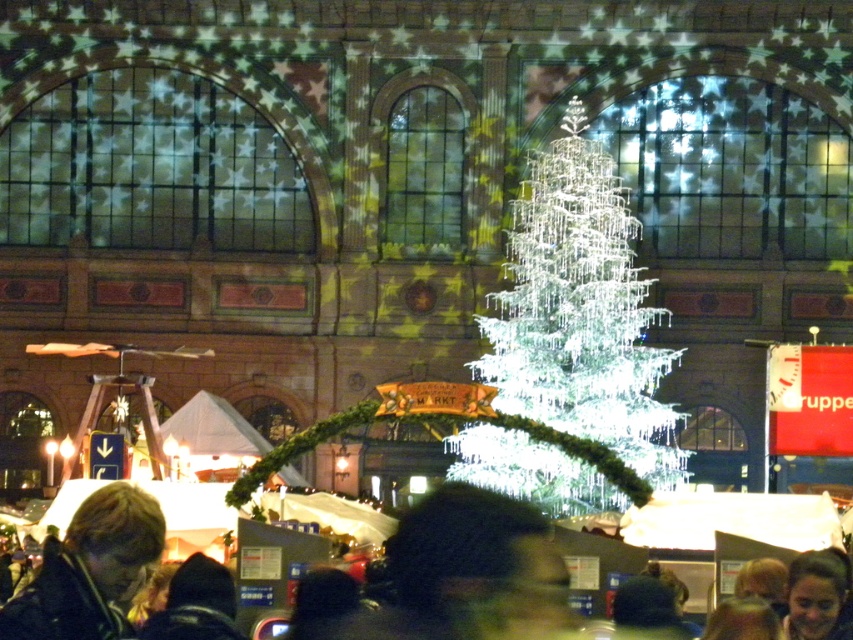
You are an interior designer planning to place a decorative item between the icy white crystal at center and the dark brown hair at lower center. Which object should you avoid placing there to maintain balance?

You should avoid placing the icy white crystal at center because it is thinner than the dark brown hair at lower center, so placing it between them might disrupt the balance due to its slimmer profile.